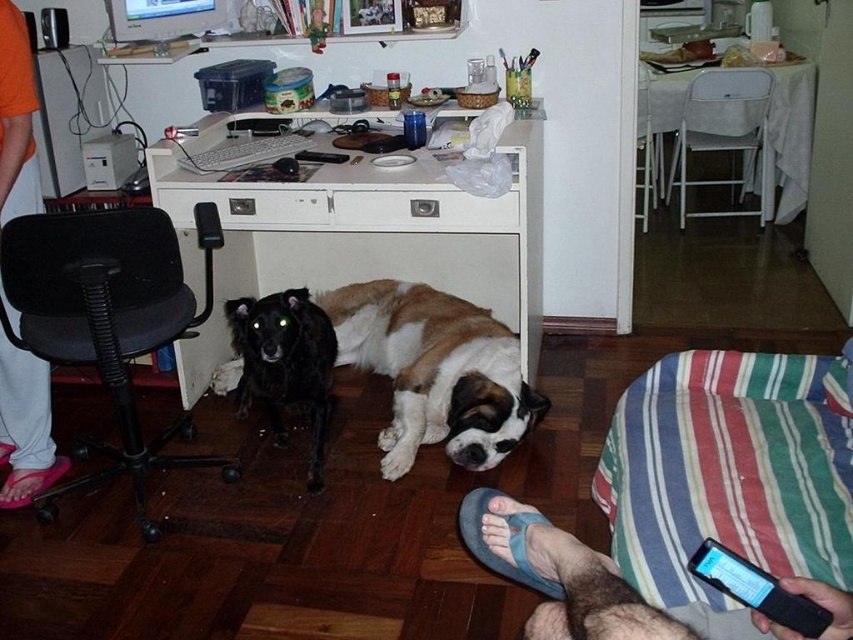
Question: Which point is closer to the camera taking this photo?

Choices:
 (A) (720, 586)
 (B) (322, 460)

Answer: (A)

Question: Is brown and white fur at center behind orange fabric pants at lower left?

Choices:
 (A) yes
 (B) no

Answer: (A)

Question: Which point is closer to the camera taking this photo?

Choices:
 (A) (485, 234)
 (B) (645, 93)
 (C) (792, 618)
 (D) (119, 17)

Answer: (C)

Question: Is brown and white fur at center closer to camera compared to gray fabric leg at lower right?

Choices:
 (A) yes
 (B) no

Answer: (B)

Question: Does white wood computer desk at center appear on the left side of black mesh office chair at left?

Choices:
 (A) yes
 (B) no

Answer: (B)

Question: Which is farther from the white plastic chair at upper right?

Choices:
 (A) black fur dog at center
 (B) brown and white fur at center
 (C) black mesh office chair at left

Answer: (C)